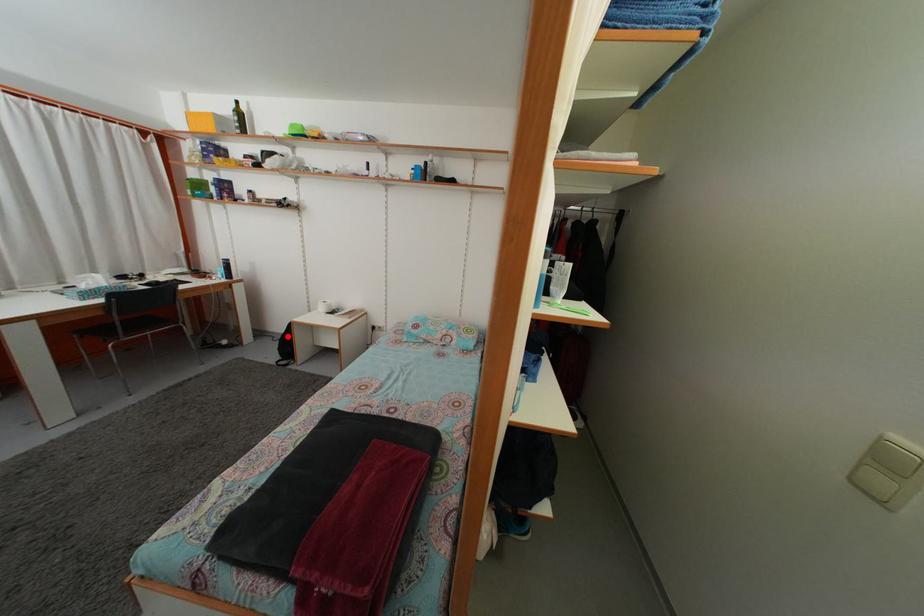
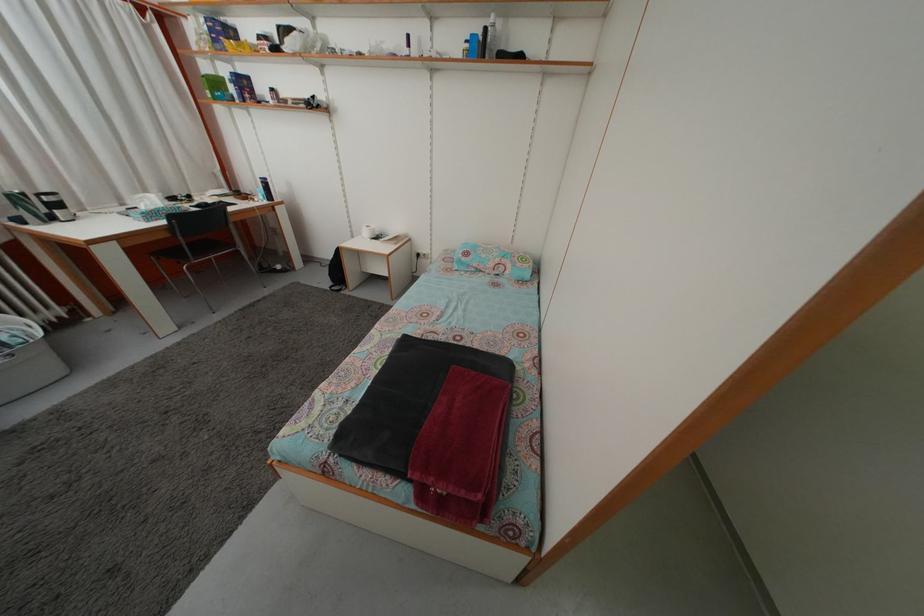
Locate, in the second image, the point that corresponds to the highlighted location in the first image.

(335, 262)